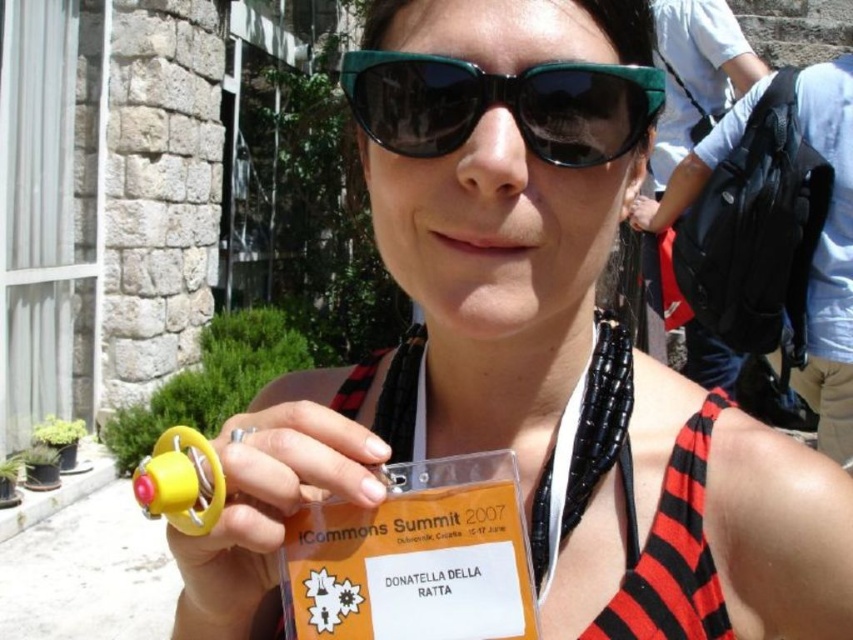
In the scene shown: Between green plastic sunglasses at center and black beaded lanyard at center, which one appears on the right side from the viewer's perspective?

black beaded lanyard at center is more to the right.

Is point (549, 99) in front of point (595, 477)?

Yes, it is in front of point (595, 477).

The width and height of the screenshot is (853, 640). Identify the location of green plastic sunglasses at center. (502, 104).

Is yellow rubber ring at lower left smaller than black beaded lanyard at center?

Yes.

Can you confirm if yellow rubber ring at lower left is positioned to the right of black beaded lanyard at center?

In fact, yellow rubber ring at lower left is to the left of black beaded lanyard at center.

This screenshot has height=640, width=853. Describe the element at coordinates (267, 508) in the screenshot. I see `yellow rubber ring at lower left` at that location.

Image resolution: width=853 pixels, height=640 pixels. Find the location of `yellow rubber ring at lower left`. yellow rubber ring at lower left is located at coordinates (267, 508).

Is black beaded lanyard at center smaller than red striped bikini top at center?

Actually, black beaded lanyard at center might be larger than red striped bikini top at center.

Is black beaded lanyard at center below red striped bikini top at center?

No.

You are a GUI agent. You are given a task and a screenshot of the screen. Output one action in this format:
    pyautogui.click(x=<x>, y=<y>)
    Task: Click on the black beaded lanyard at center
    This screenshot has width=853, height=640.
    Given the screenshot: What is the action you would take?
    pyautogui.click(x=585, y=451)